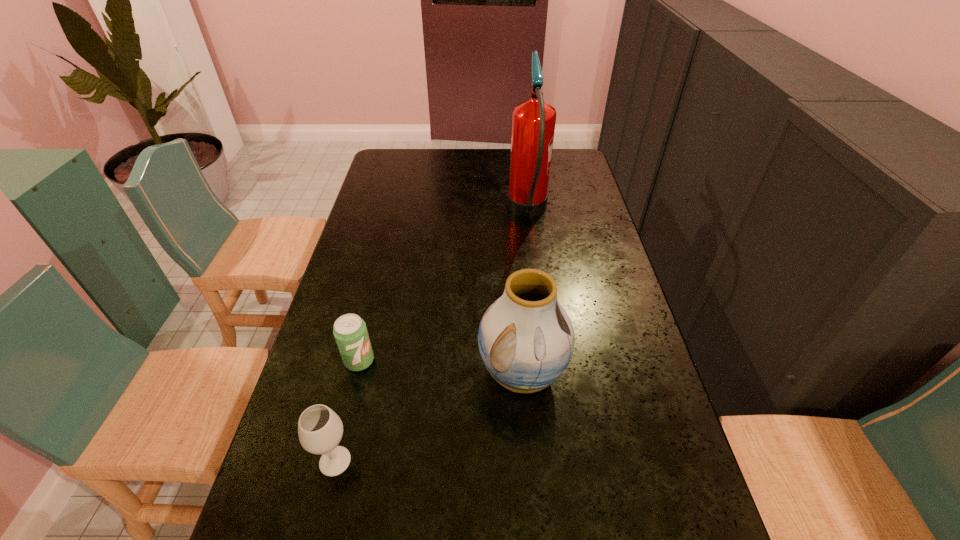
The width and height of the screenshot is (960, 540). I want to click on the tallest object, so click(533, 125).

At what (x,y) coordinates should I click in order to perform the action: click on the farthest object. Please return your answer as a coordinate pair (x, y). The image size is (960, 540). Looking at the image, I should click on (533, 125).

Where is `the second tallest object`? The width and height of the screenshot is (960, 540). the second tallest object is located at coordinates click(x=526, y=339).

The height and width of the screenshot is (540, 960). In order to click on wineglass in this screenshot , I will do `click(320, 429)`.

At what (x,y) coordinates should I click in order to perform the action: click on the nearest object. Please return your answer as a coordinate pair (x, y). The height and width of the screenshot is (540, 960). Looking at the image, I should click on (320, 429).

Where is `soda`? soda is located at coordinates (350, 332).

Identify the location of blank area located 0.270m on the left of the farthest object. (433, 212).

This screenshot has height=540, width=960. Identify the location of vacant point located on the front of the third shortest object. click(x=532, y=496).

At what (x,y) coordinates should I click in order to perform the action: click on vacant space situated on the right of the second shortest object. Please return your answer as a coordinate pair (x, y). This screenshot has width=960, height=540. Looking at the image, I should click on pos(474,461).

Where is `vacant space located on the back of the soda`? This screenshot has width=960, height=540. vacant space located on the back of the soda is located at coordinates (377, 289).